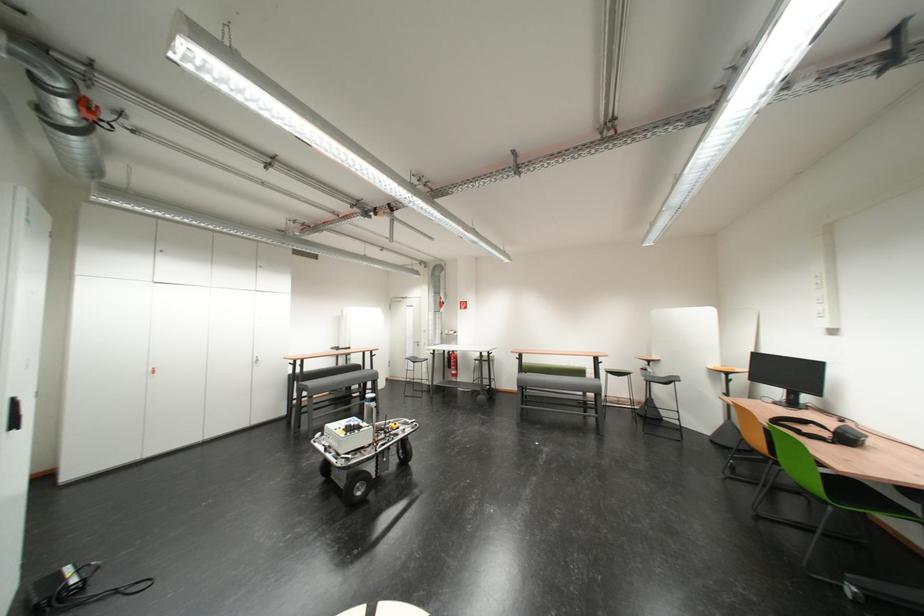
The width and height of the screenshot is (924, 616). What are the coordinates of `green chair sitting surface` in the screenshot? It's located at (616, 373).